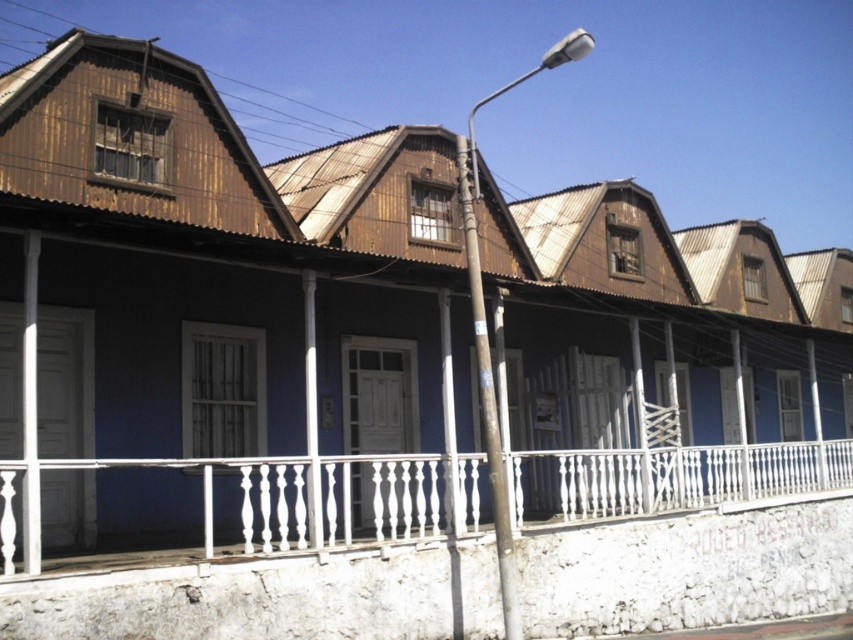
Does point (360, 536) come behind point (515, 612)?

That is True.

Consider the image. Does white painted wood balustrade at center appear on the left side of smooth gray pole at center?

Incorrect, white painted wood balustrade at center is not on the left side of smooth gray pole at center.

I want to click on white painted wood balustrade at center, so click(299, 499).